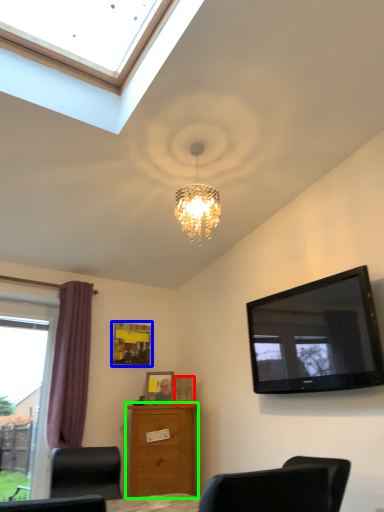
Question: Which object is the farthest from picture frame (highlighted by a red box)? Choose among these: picture frame (highlighted by a blue box) or chest of drawers (highlighted by a green box).

Choices:
 (A) picture frame
 (B) chest of drawers

Answer: (A)